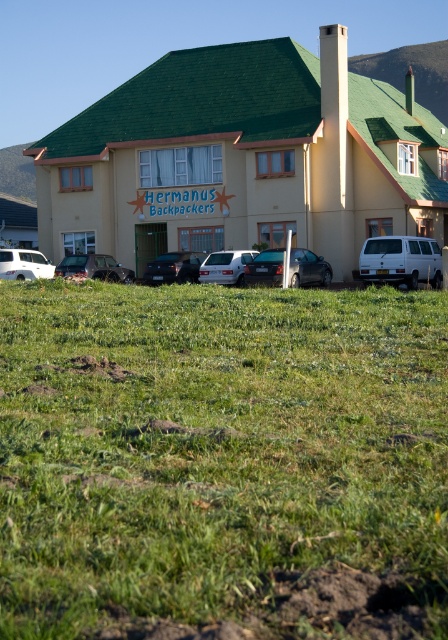
Who is lower down, metallic silver car at center or white matte van at center?

white matte van at center is lower down.

In the scene shown: Can you confirm if metallic silver car at center is wider than white matte van at center?

No.

Between point (67, 275) and point (224, 278), which one is positioned in front?

Point (224, 278) is in front.

You are a GUI agent. You are given a task and a screenshot of the screen. Output one action in this format:
    pyautogui.click(x=<x>, y=<y>)
    Task: Click on the metallic silver car at center
    The image size is (448, 640).
    Given the screenshot: What is the action you would take?
    click(94, 268)

Can you confirm if green grass at lower center is bigger than white matte van at center?

Yes.

Measure the distance from green grass at lower center to white matte van at center.

green grass at lower center is 17.31 meters away from white matte van at center.

Who is more forward, [116,502] or [222,257]?

Point [116,502] is more forward.

I want to click on green grass at lower center, so click(x=222, y=461).

Which is above, white matte van at lower right or metallic silver sedan at center?

white matte van at lower right is above.

Which is behind, point (406, 256) or point (171, 259)?

The point (171, 259) is more distant.

This screenshot has width=448, height=640. I want to click on white matte van at lower right, so click(400, 260).